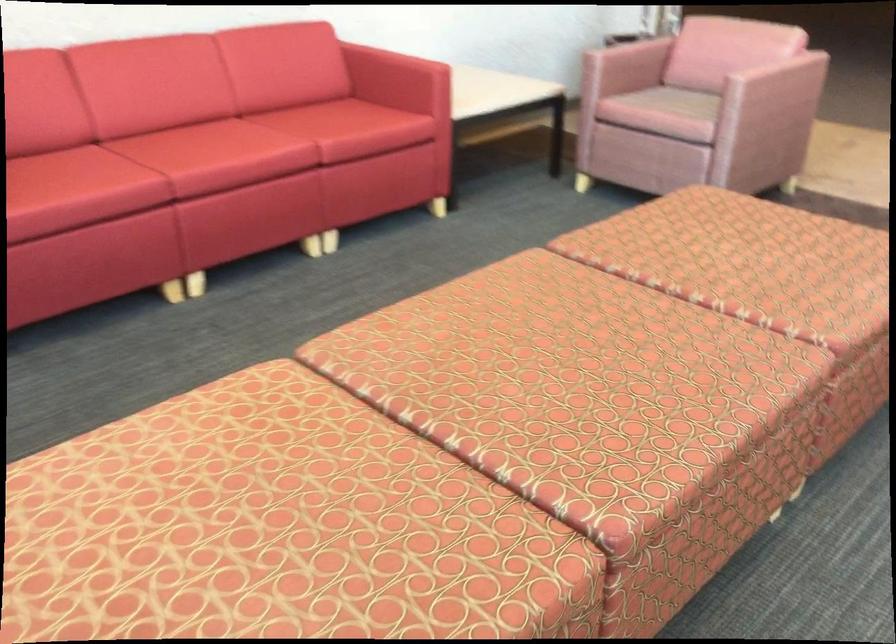
Describe the element at coordinates (773, 90) in the screenshot. I see `the sofa armrest` at that location.